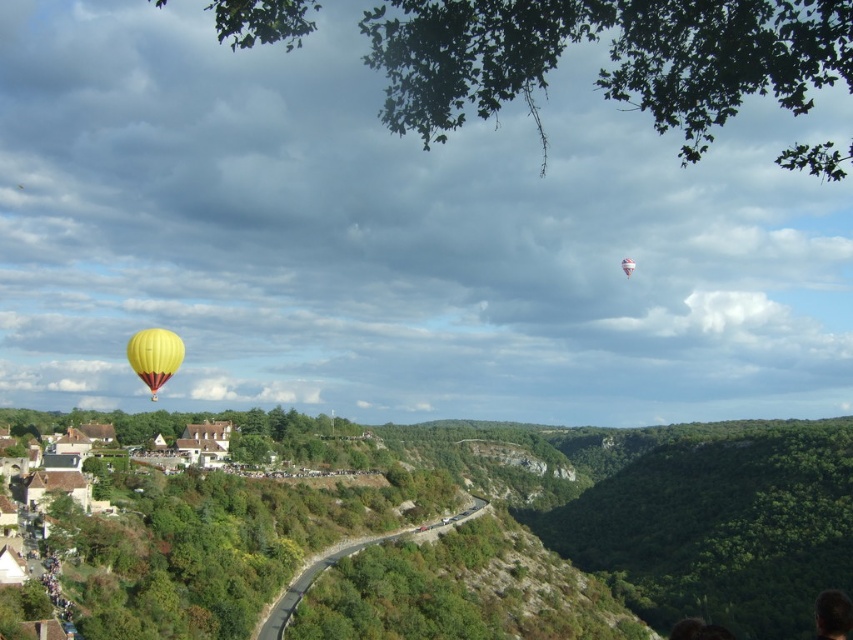
Between point (154, 358) and point (627, 257), which one is positioned in front?

Positioned in front is point (154, 358).

Between yellow fabric balloon at lower left and yellow fabric hot air balloon at upper left, which one appears on the right side from the viewer's perspective?

From the viewer's perspective, yellow fabric hot air balloon at upper left appears more on the right side.

Describe the element at coordinates (154, 356) in the screenshot. The width and height of the screenshot is (853, 640). I see `yellow fabric balloon at lower left` at that location.

Identify the location of yellow fabric balloon at lower left. The height and width of the screenshot is (640, 853). (154, 356).